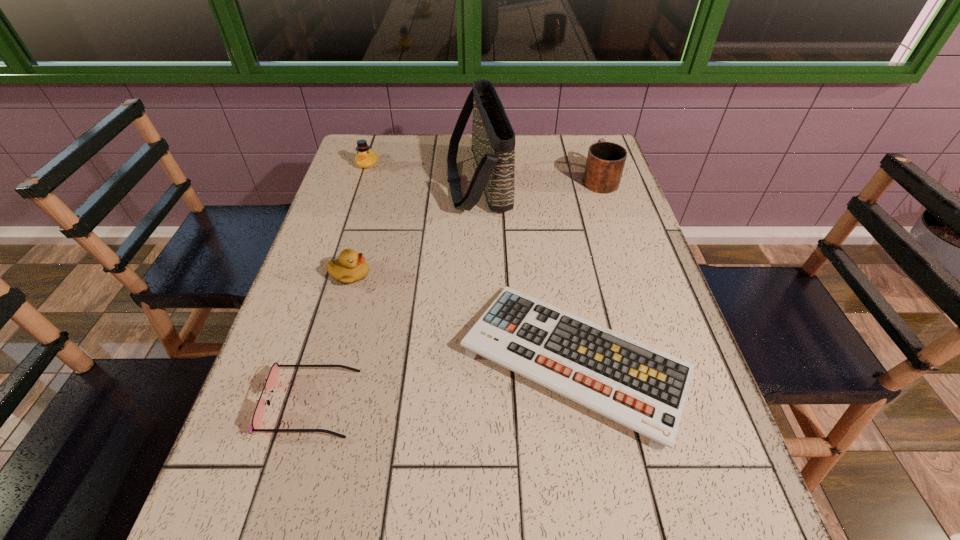
You are a GUI agent. You are given a task and a screenshot of the screen. Output one action in this format:
    pyautogui.click(x=<x>, y=<y>)
    Task: Click on the free area in between the second shortest object and the handbag
    Image resolution: width=960 pixels, height=540 pixels.
    Given the screenshot: What is the action you would take?
    pyautogui.click(x=395, y=292)

At what (x,y) coordinates should I click in order to perform the action: click on vacant area that lies between the duckling and the shortest object. Please return your answer as a coordinate pair (x, y). The image size is (960, 540). Looking at the image, I should click on (463, 318).

At what (x,y) coordinates should I click in order to perform the action: click on empty space that is in between the mug and the tallest object. Please return your answer as a coordinate pair (x, y). This screenshot has width=960, height=540. Looking at the image, I should click on (539, 180).

Find the location of a particular element. This screenshot has width=960, height=540. vacant point located between the shortest object and the sunglasses is located at coordinates (443, 382).

Where is `blank region between the handbag and the second tallest object`? This screenshot has height=540, width=960. blank region between the handbag and the second tallest object is located at coordinates (539, 180).

You are a GUI agent. You are given a task and a screenshot of the screen. Output one action in this format:
    pyautogui.click(x=<x>, y=<y>)
    Task: Click on the vacant space that is in between the duckling and the second tallest object
    This screenshot has height=540, width=960.
    Given the screenshot: What is the action you would take?
    pyautogui.click(x=474, y=226)

You are a GUI agent. You are given a task and a screenshot of the screen. Output one action in this format:
    pyautogui.click(x=<x>, y=<y>)
    Task: Click on the fifth closest object to the shortest object
    The width and height of the screenshot is (960, 540).
    Given the screenshot: What is the action you would take?
    pyautogui.click(x=366, y=157)

Identify which object is the fourth closest to the tallest object. Please provide its 2D coordinates. Your answer should be formatted as a tuple, i.e. [(x, y)], where the tuple contains the x and y coordinates of a point satisfying the conditions above.

[(643, 388)]

The width and height of the screenshot is (960, 540). I want to click on free location that satisfies the following two spatial constraints: 1. on the front-facing side of the shortest object; 2. on the left side of the duck, so click(x=303, y=360).

This screenshot has width=960, height=540. Identify the location of free space that satisfies the following two spatial constraints: 1. on the front-facing side of the duck; 2. on the left side of the handbag. (362, 181).